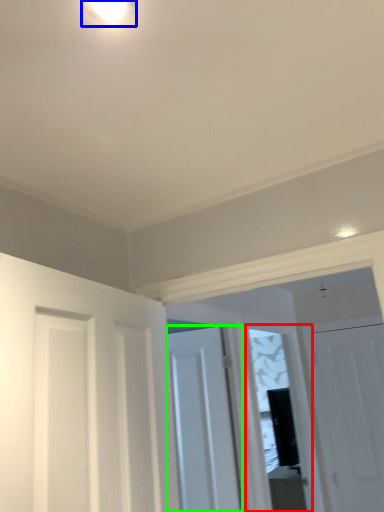
Question: Based on their relative distances, which object is nearer to window (highlighted by a red box)? Choose from light fixture (highlighted by a blue box) and door (highlighted by a green box).

Choices:
 (A) light fixture
 (B) door

Answer: (B)